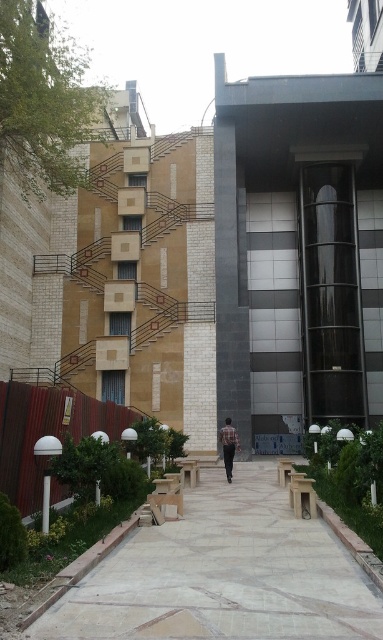
Based on the photo, you are a delivery person carrying a large package and need to walk through the scene. The light gray concrete pavement at center and the brown plaid shirt at center are both in your path. Which path should you choose to ensure your package doesn

The light gray concrete pavement at center is wider than the brown plaid shirt at center, so you should choose the light gray concrete pavement at center to ensure your package has enough space to pass safely.

You are standing in the urban scene and want to take a photo. There are two points of interest marked as point 1 and point 2. Point 1 is at coordinate [358,624] and point 2 is at [230,461]. Which point is closer to you so you can focus your camera lens on it first?

Point 1 at coordinate [358,624] is closer to the camera than point 2 at [230,461], so you should focus your camera lens on point 1 first.

You are standing at the entrance of the modern building complex and see the light gray concrete pavement at center and the brown plaid shirt at center. Which object is located to the left side from your perspective?

The light gray concrete pavement at center is to the left of the brown plaid shirt at center, so the light gray concrete pavement at center is located to the left side from your perspective.